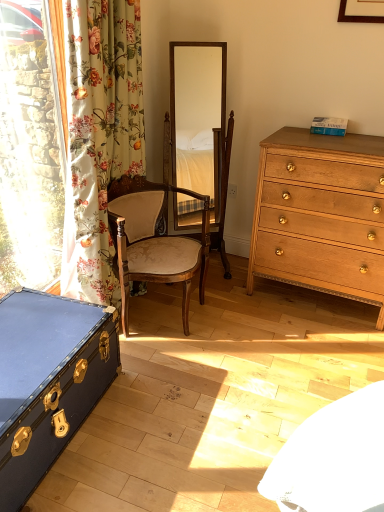
Find the location of a particular element. The height and width of the screenshot is (512, 384). free space above light brown wood chest of drawers at right (from a real-world perspective) is located at coordinates [x=355, y=138].